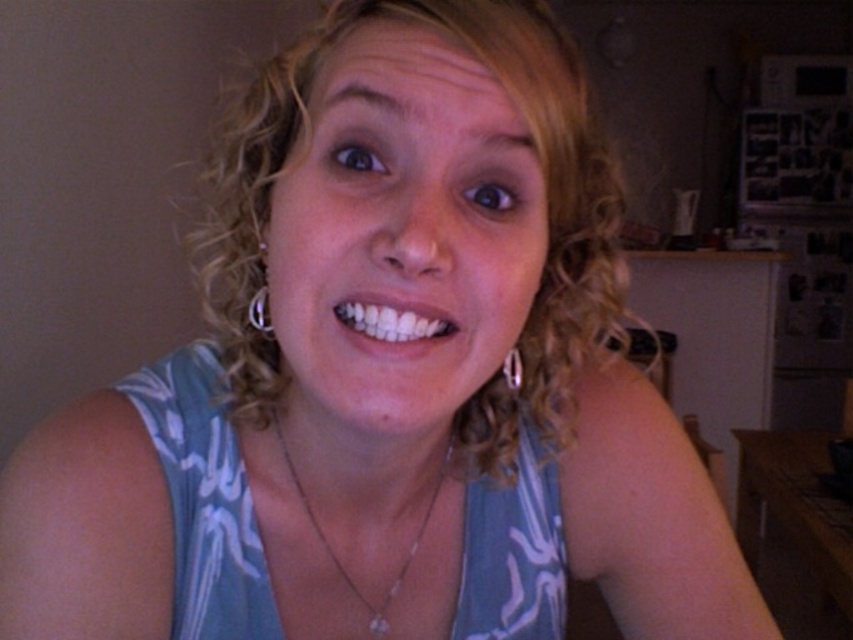
You are an interior designer assessing the placement of two decorative items in the room. The first item is at point (509, 282) and the second at point (531, 452). Which item is positioned closer to the viewer?

Point (509, 282) is closer to the viewer than point (531, 452).